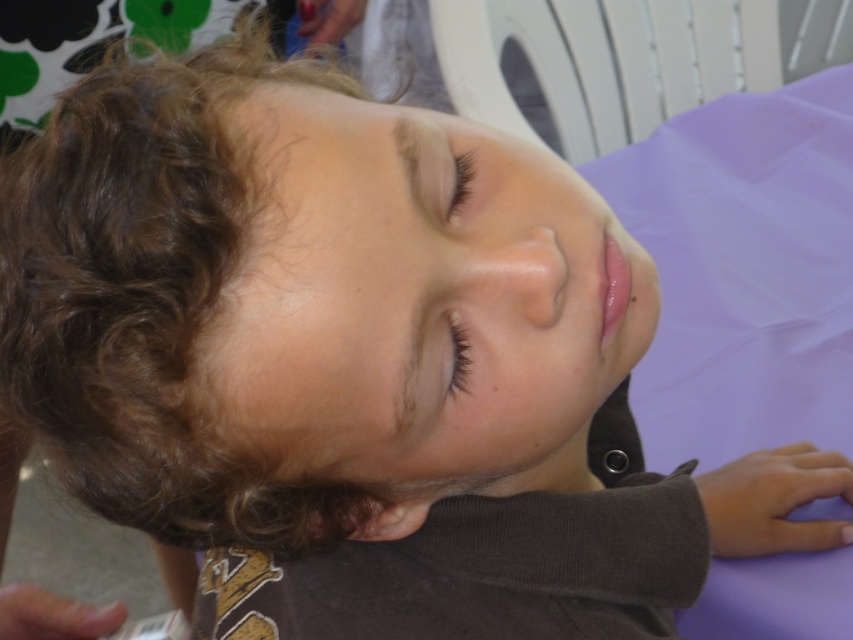
Question: Which point is closer to the camera?

Choices:
 (A) brown matte eye at center
 (B) black eyelashes at upper center

Answer: (A)

Question: Does brown matte eye at center have a smaller size compared to black eyelashes at upper center?

Choices:
 (A) no
 (B) yes

Answer: (B)

Question: Among these points, which one is farthest from the camera?

Choices:
 (A) (109, 488)
 (B) (456, 372)

Answer: (A)

Question: Considering the real-world distances, which object is farthest from the brown matte eye at center?

Choices:
 (A) black eyelashes at upper center
 (B) curly brown hair at upper left

Answer: (B)

Question: Considering the relative positions of curly brown hair at upper left and black eyelashes at upper center in the image provided, where is curly brown hair at upper left located with respect to black eyelashes at upper center?

Choices:
 (A) below
 (B) above

Answer: (A)

Question: Does curly brown hair at upper left appear over black eyelashes at upper center?

Choices:
 (A) no
 (B) yes

Answer: (A)